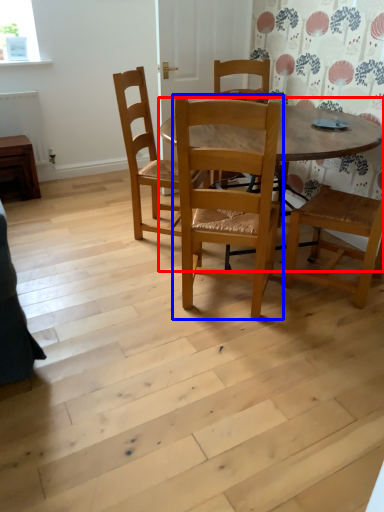
Question: Among these objects, which one is nearest to the camera, kitchen & dining room table (highlighted by a red box) or chair (highlighted by a blue box)?

Choices:
 (A) kitchen & dining room table
 (B) chair

Answer: (B)